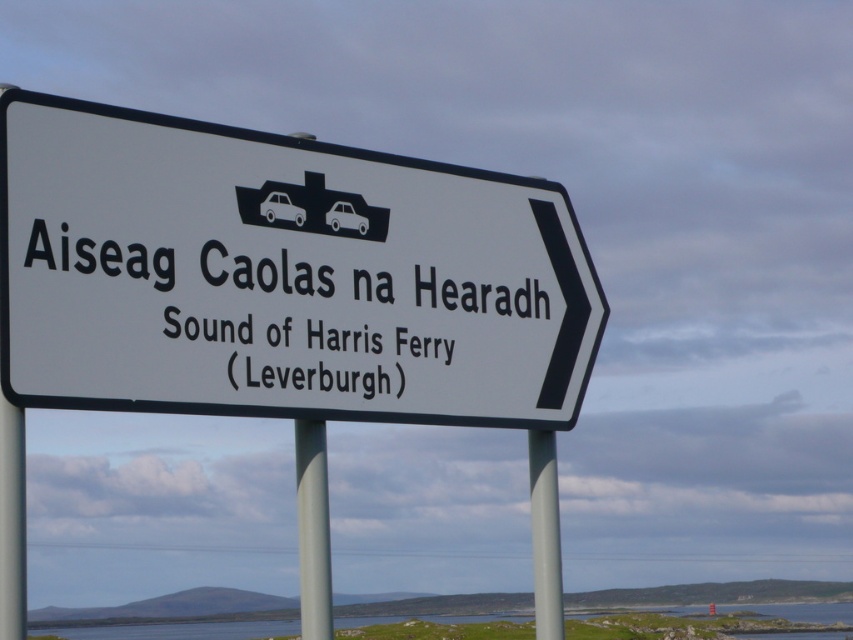
Question: Is white plastic sign at center bigger than white paper sign at center?

Choices:
 (A) yes
 (B) no

Answer: (A)

Question: Does white plastic sign at center have a smaller size compared to white paper sign at center?

Choices:
 (A) yes
 (B) no

Answer: (B)

Question: Which object appears closest to the camera in this image?

Choices:
 (A) gray metallic pole at center
 (B) white paper sign at center
 (C) white plastic pole at left

Answer: (C)

Question: Estimate the real-world distances between objects in this image. Which object is closer to the gray metallic pole at center?

Choices:
 (A) white plastic pole at left
 (B) white paper sign at center

Answer: (B)

Question: Estimate the real-world distances between objects in this image. Which object is farther from the white plastic sign at center?

Choices:
 (A) white plastic pole at left
 (B) gray metallic pole at center

Answer: (B)

Question: Is white paper sign at center smaller than white plastic pole at left?

Choices:
 (A) no
 (B) yes

Answer: (A)